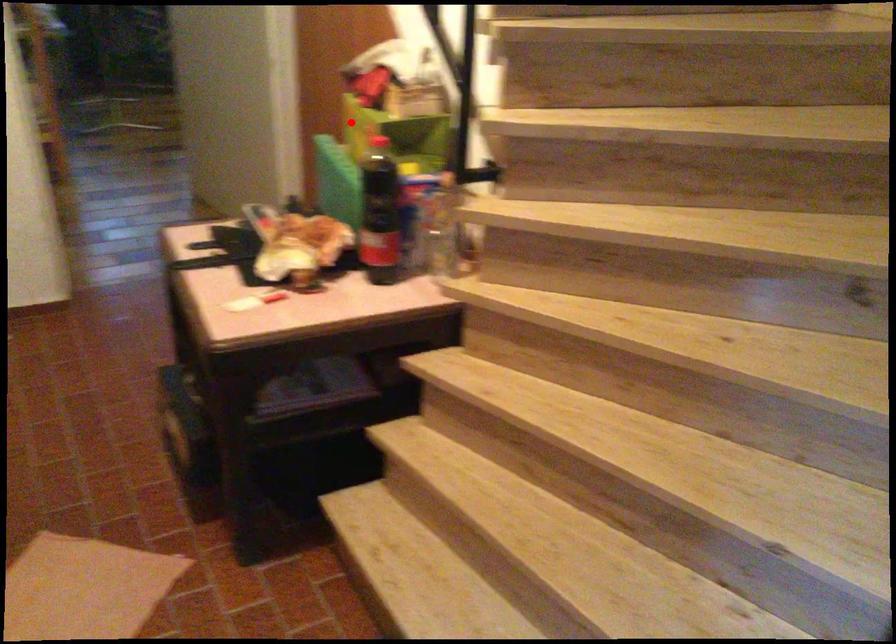
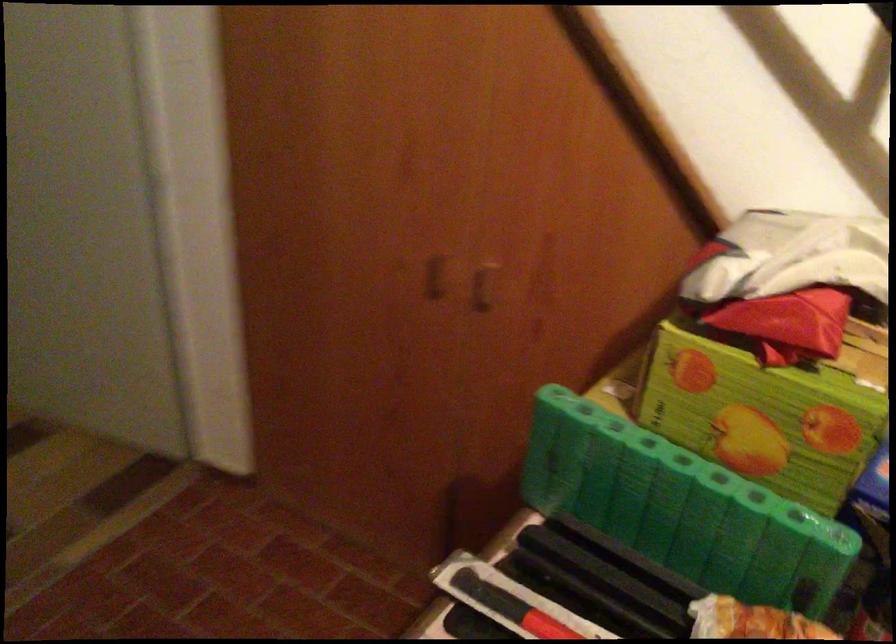
Locate, in the second image, the point that corresponds to the highlighted location in the first image.

(686, 377)